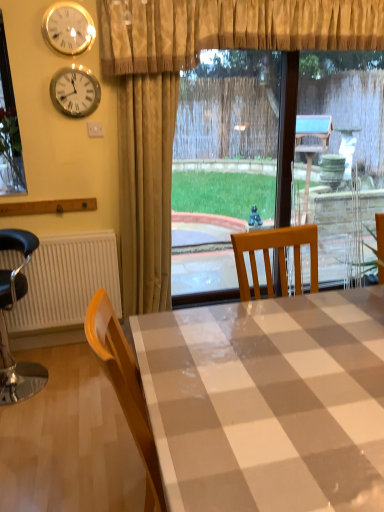
Question: Should I look upward or downward to see white ribbed radiator at lower left?

Choices:
 (A) down
 (B) up

Answer: (A)

Question: Would you say gold textured curtain at upper center, which is the second curtain from top to bottom, is part of metallic clock at upper left, which is the second clock in top-to-bottom order,'s contents?

Choices:
 (A) no
 (B) yes

Answer: (A)

Question: Can you confirm if metallic clock at upper left, the first clock in the bottom-to-top sequence, is taller than gold textured curtain at upper center, arranged as the first curtain when ordered from the bottom?

Choices:
 (A) no
 (B) yes

Answer: (A)

Question: Is metallic clock at upper left, which is the second clock in top-to-bottom order, outside gold textured curtain at upper center, arranged as the first curtain when ordered from the bottom?

Choices:
 (A) yes
 (B) no

Answer: (A)

Question: Would you consider metallic clock at upper left, which is the second clock in top-to-bottom order, to be distant from gold textured curtain at upper center, which is the second curtain from top to bottom?

Choices:
 (A) no
 (B) yes

Answer: (A)

Question: Considering the relative sizes of metallic clock at upper left, the first clock in the bottom-to-top sequence, and gold textured curtain at upper center, which is the second curtain from top to bottom, in the image provided, is metallic clock at upper left, the first clock in the bottom-to-top sequence, wider than gold textured curtain at upper center, which is the second curtain from top to bottom,?

Choices:
 (A) yes
 (B) no

Answer: (B)

Question: Can you confirm if metallic clock at upper left, which is the second clock in top-to-bottom order, is positioned to the right of gold textured curtain at upper center, arranged as the first curtain when ordered from the bottom?

Choices:
 (A) no
 (B) yes

Answer: (A)

Question: Is the depth of metallic black chair at left less than that of gold textured curtain at upper center, which is the second curtain from top to bottom?

Choices:
 (A) no
 (B) yes

Answer: (B)

Question: Is metallic black chair at left shorter than gold textured curtain at upper center, arranged as the first curtain when ordered from the bottom?

Choices:
 (A) yes
 (B) no

Answer: (A)

Question: From a real-world perspective, is metallic black chair at left under gold textured curtain at upper center, which is the second curtain from top to bottom?

Choices:
 (A) yes
 (B) no

Answer: (A)

Question: Is metallic black chair at left not inside gold textured curtain at upper center, which is the second curtain from top to bottom?

Choices:
 (A) yes
 (B) no

Answer: (A)

Question: Considering the relative sizes of metallic black chair at left and gold textured curtain at upper center, arranged as the first curtain when ordered from the bottom, in the image provided, is metallic black chair at left smaller than gold textured curtain at upper center, arranged as the first curtain when ordered from the bottom,?

Choices:
 (A) no
 (B) yes

Answer: (B)

Question: From a real-world perspective, is metallic black chair at left located higher than gold textured curtain at upper center, which is the second curtain from top to bottom?

Choices:
 (A) yes
 (B) no

Answer: (B)

Question: Can you confirm if white glossy table at center is thinner than beige textured curtain at upper center, the first curtain viewed from the top?

Choices:
 (A) yes
 (B) no

Answer: (B)